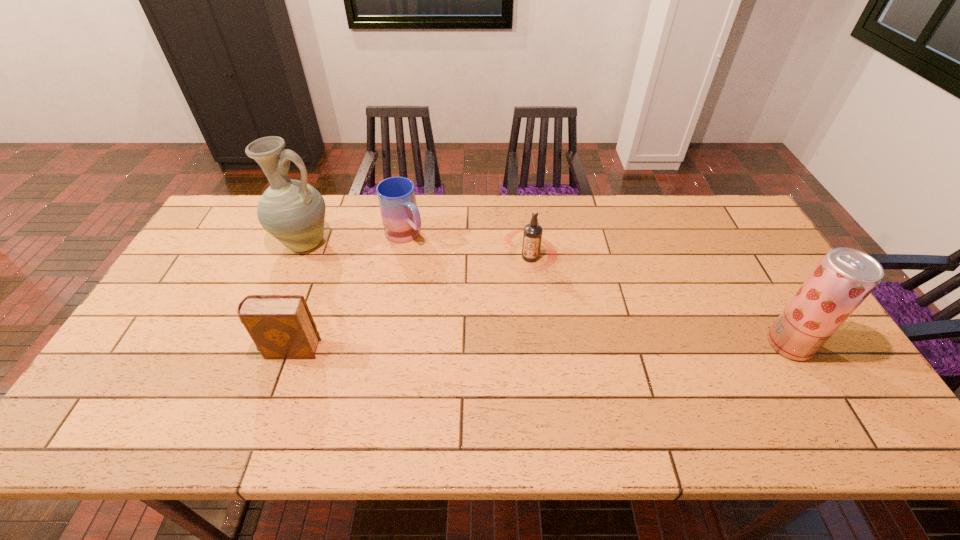
The height and width of the screenshot is (540, 960). Identify the location of free space in the image that satisfies the following two spatial constraints: 1. on the front side of the third object from right to left; 2. on the left side of the rightmost object. point(385,345).

Where is `vacant space that satisfies the following two spatial constraints: 1. on the front side of the diary; 2. on the spine side of the tallest object`? The height and width of the screenshot is (540, 960). vacant space that satisfies the following two spatial constraints: 1. on the front side of the diary; 2. on the spine side of the tallest object is located at coordinates (260, 349).